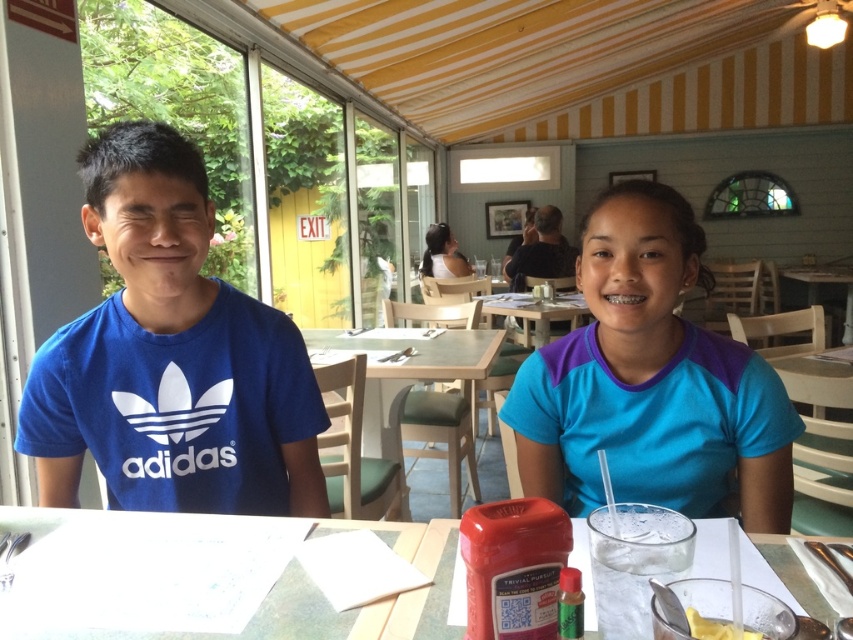
Question: Is blue cotton shirt at left smaller than yellow creamy dessert at lower right?

Choices:
 (A) yes
 (B) no

Answer: (B)

Question: Which of the following is the closest to the observer?

Choices:
 (A) (155, 248)
 (B) (654, 403)
 (C) (387, 612)
 (D) (517, 314)

Answer: (C)

Question: Does blue cotton shirt at left appear over yellow creamy dessert at lower right?

Choices:
 (A) yes
 (B) no

Answer: (A)

Question: Is blue fabric shirt at center to the right of clear glass table at center from the viewer's perspective?

Choices:
 (A) yes
 (B) no

Answer: (A)

Question: Which point is closer to the camera taking this photo?

Choices:
 (A) (560, 314)
 (B) (308, 346)
 (C) (699, 440)

Answer: (C)

Question: Estimate the real-world distances between objects in this image. Which object is closer to the yellow creamy dessert at lower right?

Choices:
 (A) wooden table at center
 (B) clear glass table at center
 (C) blue fabric shirt at center
 (D) blue cotton shirt at left

Answer: (B)